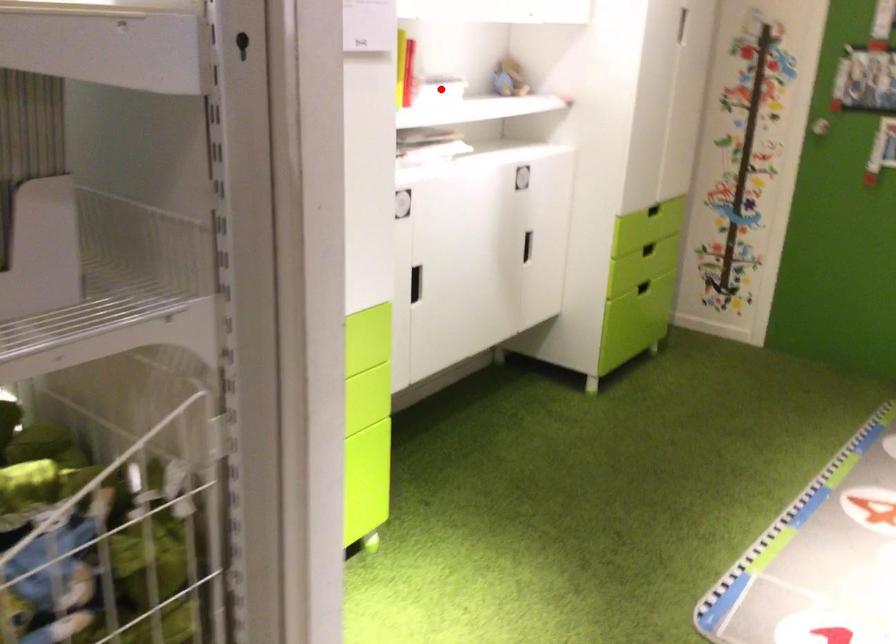
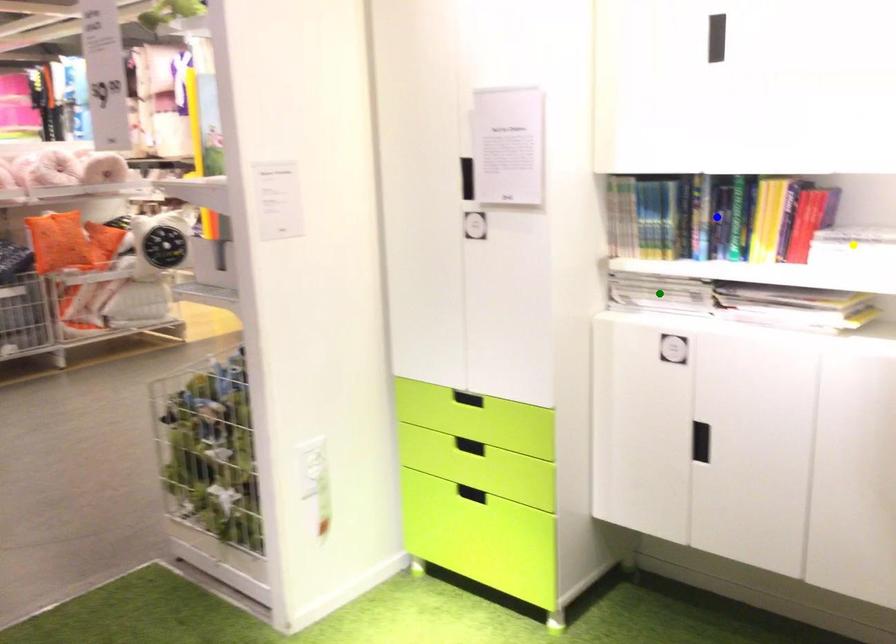
Question: I am providing you with two images of the same scene from different viewpoints. A red point is marked on the first image. You are given multiple points on the second image. Which point in image 2 is actually the same real-world point as the red point in image 1?

Choices:
 (A) green point
 (B) blue point
 (C) yellow point

Answer: (C)